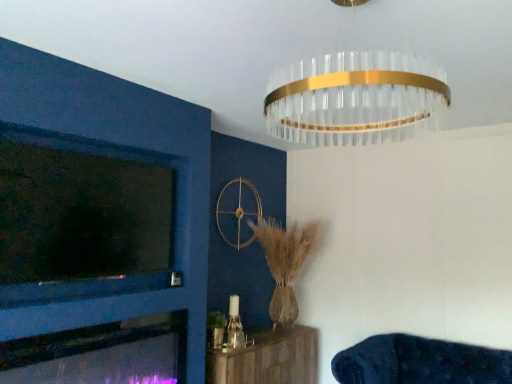
Question: Does clear glass chandelier at upper center have a lesser height compared to matte glass fireplace at lower left?

Choices:
 (A) no
 (B) yes

Answer: (A)

Question: Would you say clear glass chandelier at upper center contains matte glass fireplace at lower left?

Choices:
 (A) yes
 (B) no

Answer: (B)

Question: Are clear glass chandelier at upper center and matte glass fireplace at lower left beside each other?

Choices:
 (A) yes
 (B) no

Answer: (B)

Question: From a real-world perspective, does clear glass chandelier at upper center stand above matte glass fireplace at lower left?

Choices:
 (A) no
 (B) yes

Answer: (B)

Question: Is clear glass chandelier at upper center positioned before matte glass fireplace at lower left?

Choices:
 (A) no
 (B) yes

Answer: (B)

Question: Visually, is wooden shelf at lower center, placed as the 2th furniture when sorted from right to left, positioned to the left or to the right of dark blue plush couch at lower right, marked as the 2th furniture in a left-to-right arrangement?

Choices:
 (A) right
 (B) left

Answer: (B)

Question: Looking at their shapes, would you say wooden shelf at lower center, which ranks as the 1th furniture in left-to-right order, is wider or thinner than dark blue plush couch at lower right, which ranks as the 1th furniture in right-to-left order?

Choices:
 (A) wide
 (B) thin

Answer: (B)

Question: From their relative heights in the image, would you say wooden shelf at lower center, placed as the 2th furniture when sorted from right to left, is taller or shorter than dark blue plush couch at lower right, marked as the 2th furniture in a left-to-right arrangement?

Choices:
 (A) short
 (B) tall

Answer: (B)

Question: From the image's perspective, relative to dark blue plush couch at lower right, which ranks as the 1th furniture in right-to-left order, is wooden shelf at lower center, placed as the 2th furniture when sorted from right to left, above or below?

Choices:
 (A) below
 (B) above

Answer: (A)

Question: Would you say wooden shelf at lower center, which ranks as the 1th furniture in left-to-right order, is to the left or to the right of matte glass fireplace at lower left in the picture?

Choices:
 (A) left
 (B) right

Answer: (B)

Question: From the image's perspective, is wooden shelf at lower center, which ranks as the 1th furniture in left-to-right order, located above or below matte glass fireplace at lower left?

Choices:
 (A) above
 (B) below

Answer: (B)

Question: Is wooden shelf at lower center, placed as the 2th furniture when sorted from right to left, in front of or behind matte glass fireplace at lower left in the image?

Choices:
 (A) behind
 (B) front

Answer: (A)

Question: From a real-world perspective, is wooden shelf at lower center, which ranks as the 1th furniture in left-to-right order, positioned above or below matte glass fireplace at lower left?

Choices:
 (A) below
 (B) above

Answer: (A)

Question: From a real-world perspective, is clear glass chandelier at upper center physically located above or below matte glass fireplace at lower left?

Choices:
 (A) above
 (B) below

Answer: (A)

Question: Considering the positions of point (395, 71) and point (117, 379), is point (395, 71) closer or farther from the camera than point (117, 379)?

Choices:
 (A) closer
 (B) farther

Answer: (A)